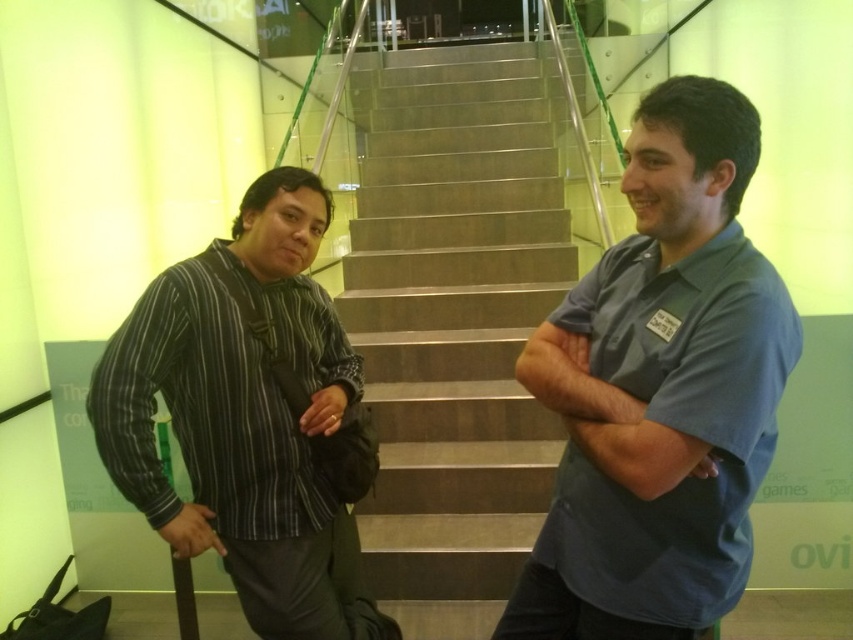
Based on the photo, you are a photographer positioned at the bottom of the staircase. You need to capture a photo of both the blue fabric shirt at center and the striped cotton shirt at left. Which person should you focus on first to ensure both are in frame?

The striped cotton shirt at left should be focused on first since the blue fabric shirt at center is to the right of it, ensuring both are within the camera frame when starting from the left side.

Looking at this image, you are standing at the bottom of the staircase and want to greet the person wearing the blue fabric shirt at center. Which direction should you move relative to the metallic staircase at center to reach them?

The blue fabric shirt at center is to the right of the metallic staircase at center, so you should move to the right of the metallic staircase at center to reach them.